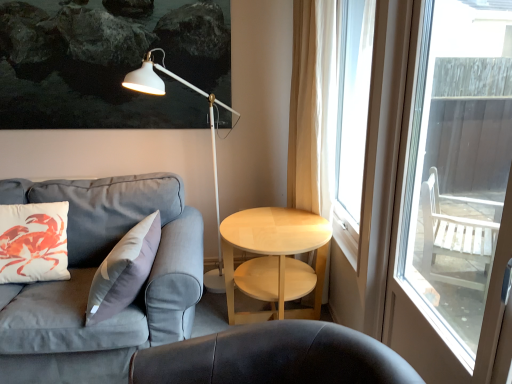
Question: Does white matte pillow at left appear on the right side of white sheer curtain at right?

Choices:
 (A) no
 (B) yes

Answer: (A)

Question: From the image's perspective, is white matte pillow at left on white sheer curtain at right?

Choices:
 (A) no
 (B) yes

Answer: (A)

Question: From the image's perspective, is white matte pillow at left under white sheer curtain at right?

Choices:
 (A) no
 (B) yes

Answer: (B)

Question: Does white matte pillow at left have a lesser width compared to white sheer curtain at right?

Choices:
 (A) yes
 (B) no

Answer: (B)

Question: Can you see white matte pillow at left touching white sheer curtain at right?

Choices:
 (A) no
 (B) yes

Answer: (A)

Question: Is white matte pillow at left in front of or behind white matte floor lamp at upper center in the image?

Choices:
 (A) behind
 (B) front

Answer: (B)

Question: Based on their positions, is white matte pillow at left located to the left or right of white matte floor lamp at upper center?

Choices:
 (A) left
 (B) right

Answer: (A)

Question: Do you think white matte pillow at left is within white matte floor lamp at upper center, or outside of it?

Choices:
 (A) outside
 (B) inside

Answer: (A)

Question: In terms of height, does white matte pillow at left look taller or shorter compared to white matte floor lamp at upper center?

Choices:
 (A) tall
 (B) short

Answer: (B)

Question: In terms of height, does white sheer curtain at right look taller or shorter compared to white sheer curtain at right?

Choices:
 (A) short
 (B) tall

Answer: (A)

Question: From a real-world perspective, relative to white sheer curtain at right, is white sheer curtain at right vertically above or below?

Choices:
 (A) above
 (B) below

Answer: (A)

Question: Is point (339, 79) closer or farther from the camera than point (288, 147)?

Choices:
 (A) farther
 (B) closer

Answer: (A)

Question: In the image, is white sheer curtain at right positioned in front of or behind white sheer curtain at right?

Choices:
 (A) front
 (B) behind

Answer: (A)

Question: From a real-world perspective, is white sheer curtain at right physically located above or below gray fabric couch at left?

Choices:
 (A) above
 (B) below

Answer: (A)

Question: From the image's perspective, relative to gray fabric couch at left, is white sheer curtain at right above or below?

Choices:
 (A) below
 (B) above

Answer: (B)